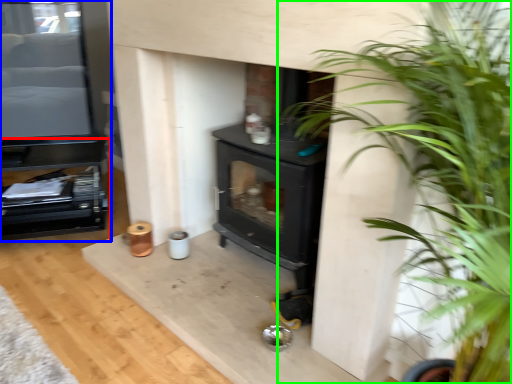
Question: Estimate the real-world distances between objects in this image. Which object is farther from entertainment center (highlighted by a red box), entertainment center (highlighted by a blue box) or houseplant (highlighted by a green box)?

Choices:
 (A) entertainment center
 (B) houseplant

Answer: (B)